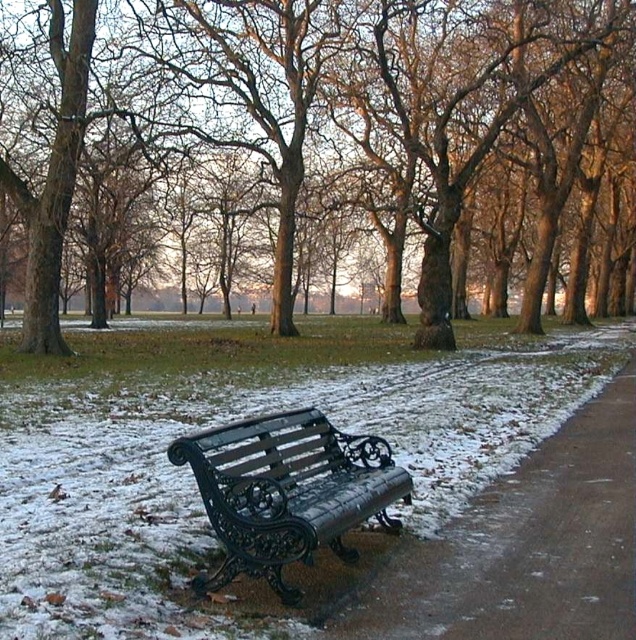
Question: Does smooth brown tree trunk at center appear over black wrought iron bench at center?

Choices:
 (A) no
 (B) yes

Answer: (B)

Question: Does smooth brown tree trunk at center have a smaller size compared to metal bench at center?

Choices:
 (A) no
 (B) yes

Answer: (A)

Question: Is metal bench at center positioned before black wrought iron bench at center?

Choices:
 (A) no
 (B) yes

Answer: (B)

Question: Among these points, which one is farthest from the camera?

Choices:
 (A) (619, 403)
 (B) (371, 179)
 (C) (361, 452)

Answer: (B)

Question: Which object is positioned farthest from the black wrought iron bench at center?

Choices:
 (A) metal bench at center
 (B) smooth brown tree trunk at center

Answer: (B)

Question: Which object is farther from the camera taking this photo?

Choices:
 (A) metal bench at center
 (B) smooth brown tree trunk at center

Answer: (B)